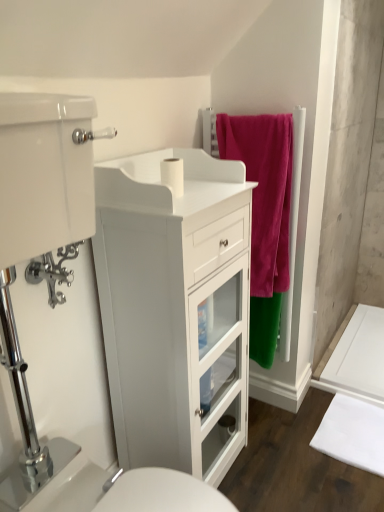
Question: Is white glossy sink at lower center shorter than velvet pink towel at upper right?

Choices:
 (A) yes
 (B) no

Answer: (A)

Question: Is white glossy sink at lower center in front of velvet pink towel at upper right?

Choices:
 (A) yes
 (B) no

Answer: (A)

Question: Does white glossy sink at lower center lie behind velvet pink towel at upper right?

Choices:
 (A) no
 (B) yes

Answer: (A)

Question: Is white glossy sink at lower center aimed at velvet pink towel at upper right?

Choices:
 (A) yes
 (B) no

Answer: (B)

Question: Does white glossy sink at lower center have a larger size compared to velvet pink towel at upper right?

Choices:
 (A) no
 (B) yes

Answer: (B)

Question: Is white glossy sink at lower center situated inside velvet pink towel at upper right or outside?

Choices:
 (A) outside
 (B) inside

Answer: (A)

Question: Is point (0, 508) positioned closer to the camera than point (261, 276)?

Choices:
 (A) farther
 (B) closer

Answer: (B)

Question: From the image's perspective, is white glossy sink at lower center above or below velvet pink towel at upper right?

Choices:
 (A) below
 (B) above

Answer: (A)

Question: Considering the positions of white glossy sink at lower center and velvet pink towel at upper right in the image, is white glossy sink at lower center bigger or smaller than velvet pink towel at upper right?

Choices:
 (A) big
 (B) small

Answer: (A)

Question: Considering the positions of white glossy cabinet at left and white matte toilet paper at center in the image, is white glossy cabinet at left bigger or smaller than white matte toilet paper at center?

Choices:
 (A) big
 (B) small

Answer: (A)

Question: Do you think white glossy cabinet at left is within white matte toilet paper at center, or outside of it?

Choices:
 (A) inside
 (B) outside

Answer: (B)

Question: Visually, is white glossy cabinet at left positioned to the left or to the right of white matte toilet paper at center?

Choices:
 (A) right
 (B) left

Answer: (A)

Question: Is white glossy cabinet at left wider or thinner than white matte toilet paper at center?

Choices:
 (A) thin
 (B) wide

Answer: (B)

Question: From the image's perspective, is white matte toilet paper at center located above or below white glossy cabinet at left?

Choices:
 (A) below
 (B) above

Answer: (B)

Question: Considering their positions, is white matte toilet paper at center located in front of or behind white glossy cabinet at left?

Choices:
 (A) front
 (B) behind

Answer: (B)